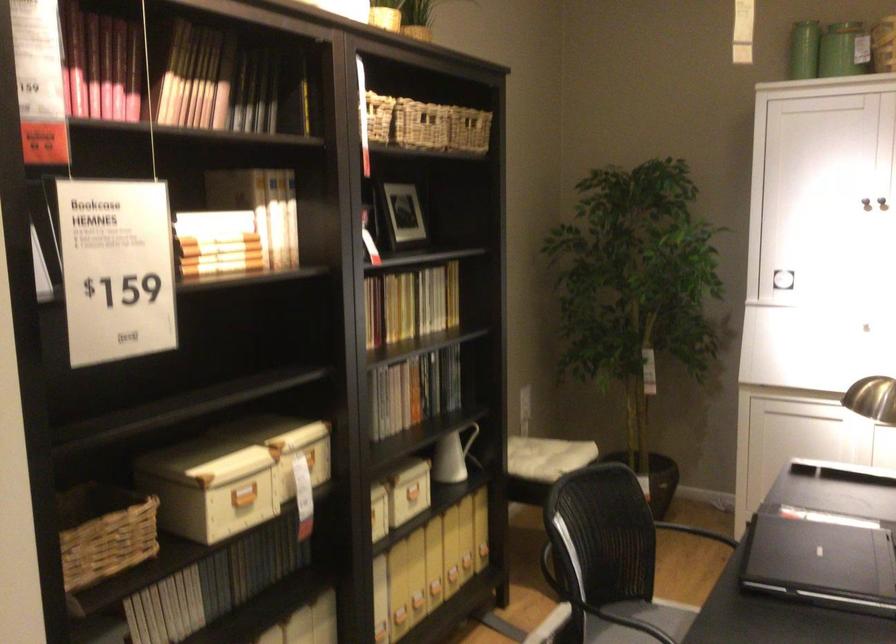
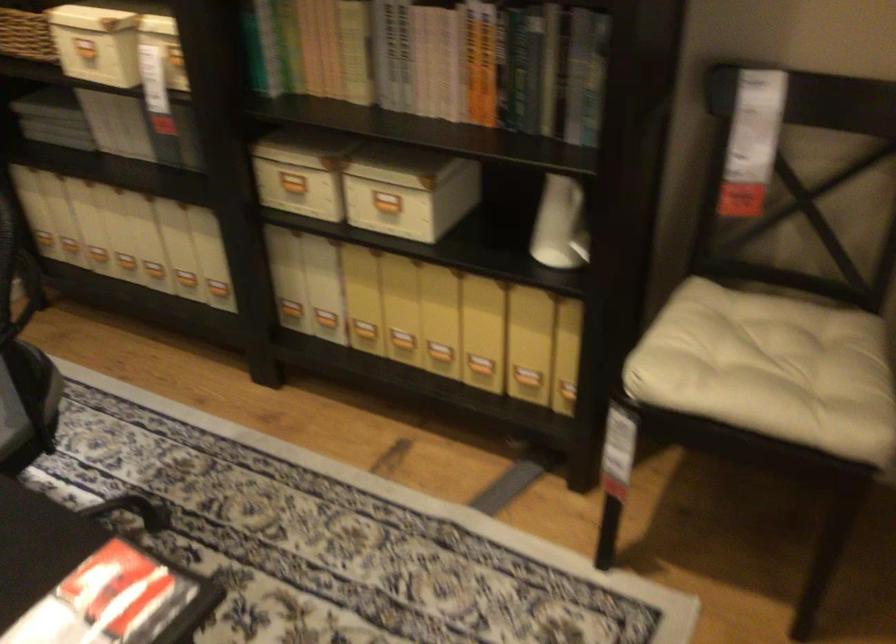
Where in the second image is the point corresponding to (371,406) from the first image?

(438, 62)